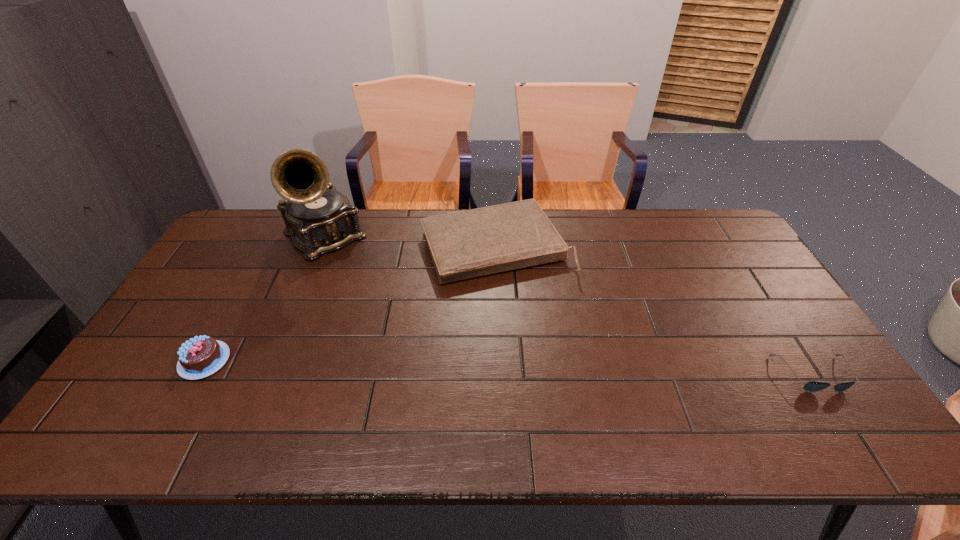
The image size is (960, 540). In order to click on free location located on the horn of the phonograph record in this screenshot , I will do `click(367, 287)`.

Locate an element on the screen. This screenshot has width=960, height=540. free space located 0.400m on the horn of the phonograph record is located at coordinates (410, 335).

The image size is (960, 540). I want to click on paperback book situated at the far edge, so click(472, 243).

Where is `phonograph record that is at the far edge`? The image size is (960, 540). phonograph record that is at the far edge is located at coordinates tap(319, 219).

Where is `chocolate cake located in the near edge section of the desktop`? The width and height of the screenshot is (960, 540). chocolate cake located in the near edge section of the desktop is located at coordinates (199, 357).

The height and width of the screenshot is (540, 960). Identify the location of sunglasses positioned at the near edge. (812, 386).

I want to click on object that is at the left edge, so click(199, 357).

You are a GUI agent. You are given a task and a screenshot of the screen. Output one action in this format:
    pyautogui.click(x=<x>, y=<y>)
    Task: Click on the object that is at the right edge
    
    Given the screenshot: What is the action you would take?
    pyautogui.click(x=812, y=386)

Locate an element on the screen. This screenshot has height=540, width=960. object present at the near left corner is located at coordinates (199, 357).

The image size is (960, 540). I want to click on object present at the near right corner, so click(x=812, y=386).